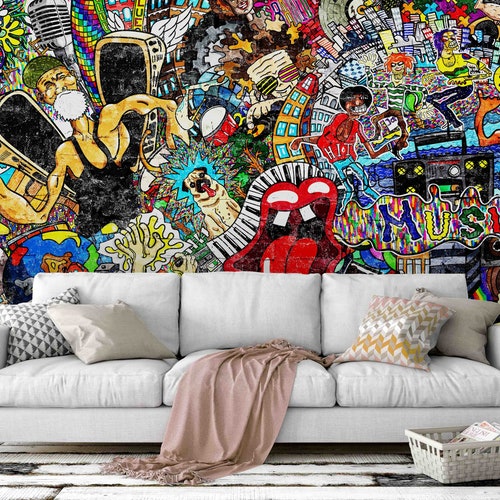
The image size is (500, 500). What are the coordinates of `back cushions` in the screenshot? It's located at (250, 301), (135, 294), (351, 306).